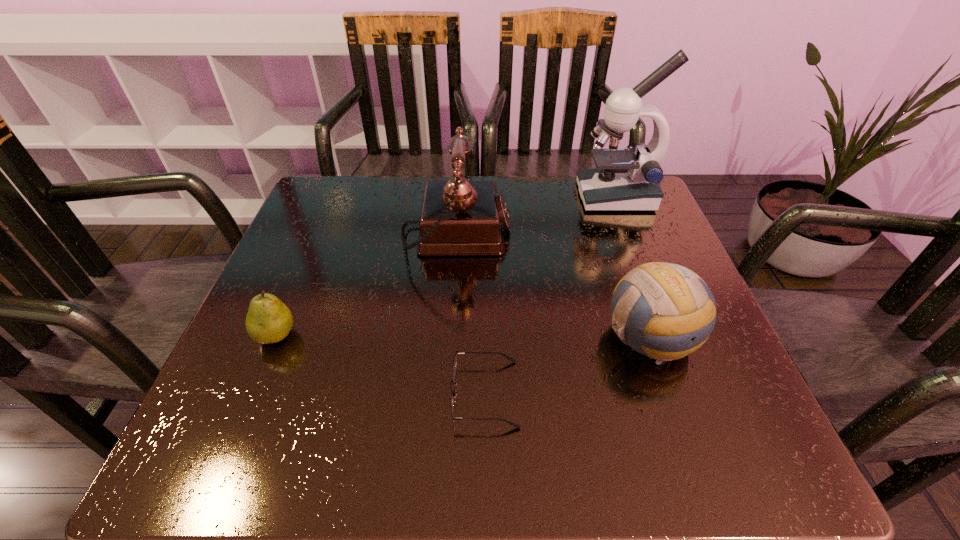
This screenshot has width=960, height=540. What are the coordinates of `the tallest object` in the screenshot? It's located at (624, 179).

Identify the location of telephone. 459,217.

The image size is (960, 540). I want to click on the third tallest object, so pos(665,311).

Identify the location of the second shortest object. (269, 320).

Identify the location of the leftmost object. The image size is (960, 540). point(269,320).

The height and width of the screenshot is (540, 960). In order to click on spectacles in this screenshot , I will do `click(457, 352)`.

I want to click on vacant region located on the left of the microscope, so click(463, 197).

The height and width of the screenshot is (540, 960). Identify the location of vacant space located on the dial of the telephone. (559, 235).

I want to click on vacant space located on the back of the third tallest object, so (627, 268).

Identify the location of vacant region located on the right of the pear. (x=467, y=335).